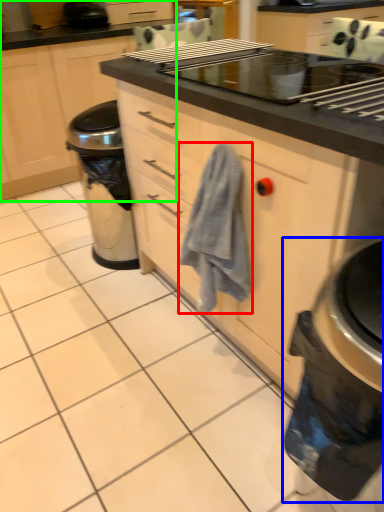
Question: Which is farther away from bath towel (highlighted by a red box)? home appliance (highlighted by a blue box) or cabinetry (highlighted by a green box)?

Choices:
 (A) home appliance
 (B) cabinetry

Answer: (B)